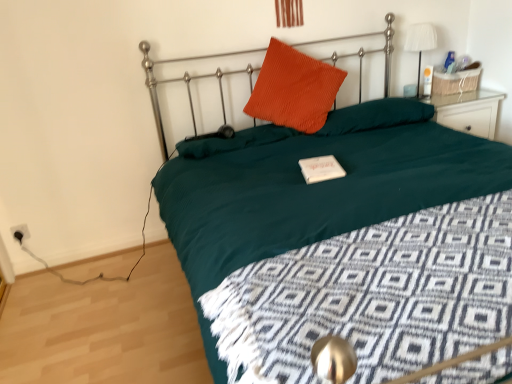
This screenshot has height=384, width=512. Describe the element at coordinates (234, 141) in the screenshot. I see `orange corduroy pillow at center, the first pillow when ordered from left to right` at that location.

Locate an element on the screen. Image resolution: width=512 pixels, height=384 pixels. orange corduroy pillow at center, the first pillow when ordered from left to right is located at coordinates (234, 141).

Find the location of a particular element. The height and width of the screenshot is (384, 512). corduroy orange pillow at center, the second pillow from the right is located at coordinates (294, 89).

What do you see at coordinates (20, 232) in the screenshot?
I see `black plastic socket at lower left` at bounding box center [20, 232].

This screenshot has height=384, width=512. What are the coordinates of `white fabric lampshade at upper right` in the screenshot? It's located at (420, 42).

Does teal fabric bed at center have a larger size compared to orange corduroy pillow at upper center, the 3th pillow in the left-to-right sequence?

Yes.

From a real-world perspective, between teal fabric bed at center and orange corduroy pillow at upper center, the 3th pillow in the left-to-right sequence, who is vertically higher?

From a 3D spatial view, orange corduroy pillow at upper center, the 3th pillow in the left-to-right sequence, is above.

Which object is more forward, teal fabric bed at center or orange corduroy pillow at upper center, the 1th pillow positioned from the right?

teal fabric bed at center is in front.

Is black plastic socket at lower left situated inside orange corduroy pillow at upper center, the 1th pillow positioned from the right, or outside?

black plastic socket at lower left is spatially situated outside orange corduroy pillow at upper center, the 1th pillow positioned from the right.

Is black plastic socket at lower left to the left or to the right of orange corduroy pillow at upper center, the 3th pillow in the left-to-right sequence, in the image?

Based on their positions, black plastic socket at lower left is located to the left of orange corduroy pillow at upper center, the 3th pillow in the left-to-right sequence.

Where is `electric outlet on the left of orange corduroy pillow at upper center, the 1th pillow positioned from the right`? The width and height of the screenshot is (512, 384). electric outlet on the left of orange corduroy pillow at upper center, the 1th pillow positioned from the right is located at coordinates (20, 232).

Can you confirm if orange corduroy pillow at center, the first pillow when ordered from left to right, is bigger than white fabric lampshade at upper right?

Correct, orange corduroy pillow at center, the first pillow when ordered from left to right, is larger in size than white fabric lampshade at upper right.

How much distance is there between orange corduroy pillow at center, the 3th pillow viewed from the right, and white fabric lampshade at upper right?

The distance of orange corduroy pillow at center, the 3th pillow viewed from the right, from white fabric lampshade at upper right is 4.28 feet.

What's the angular difference between orange corduroy pillow at center, the 3th pillow viewed from the right, and white fabric lampshade at upper right's facing directions?

0.624 degrees.

Is orange corduroy pillow at center, the 3th pillow viewed from the right, to the left of white fabric lampshade at upper right from the viewer's perspective?

Yes.

Which is correct: black plastic socket at lower left is inside white fabric lampshade at upper right, or outside of it?

black plastic socket at lower left lies outside white fabric lampshade at upper right.

Does black plastic socket at lower left lie behind white fabric lampshade at upper right?

No, the depth of black plastic socket at lower left is less than that of white fabric lampshade at upper right.

Locate an element on the screen. This screenshot has height=384, width=512. electric outlet in front of the white fabric lampshade at upper right is located at coordinates (20, 232).

Is teal fabric bed at center facing towards black plastic socket at lower left?

No, teal fabric bed at center does not turn towards black plastic socket at lower left.

Is teal fabric bed at center completely or partially outside of black plastic socket at lower left?

Yes, teal fabric bed at center is not within black plastic socket at lower left.

From a real-world perspective, is teal fabric bed at center physically below black plastic socket at lower left?

No, from a real-world perspective, teal fabric bed at center is not beneath black plastic socket at lower left.

From the image's perspective, between teal fabric bed at center and black plastic socket at lower left, who is located below?

black plastic socket at lower left appears lower in the image.

From a real-world perspective, which is physically above, black plastic socket at lower left or corduroy orange pillow at center, positioned as the 2th pillow in left-to-right order?

corduroy orange pillow at center, positioned as the 2th pillow in left-to-right order, is physically above.

Considering their positions, is black plastic socket at lower left located in front of or behind corduroy orange pillow at center, positioned as the 2th pillow in left-to-right order?

In the image, black plastic socket at lower left appears behind corduroy orange pillow at center, positioned as the 2th pillow in left-to-right order.

In the scene shown: Considering the sizes of black plastic socket at lower left and corduroy orange pillow at center, the second pillow from the right, in the image, is black plastic socket at lower left taller or shorter than corduroy orange pillow at center, the second pillow from the right,?

In the image, black plastic socket at lower left appears to be shorter than corduroy orange pillow at center, the second pillow from the right.

How many degrees apart are the facing directions of black plastic socket at lower left and corduroy orange pillow at center, the second pillow from the right?

14.1 degrees.

Which is behind, point (202, 250) or point (426, 44)?

Positioned behind is point (426, 44).

Is teal fabric bed at center turned away from white fabric lampshade at upper right?

No, white fabric lampshade at upper right is not at the back of teal fabric bed at center.

Between teal fabric bed at center and white fabric lampshade at upper right, which one has larger size?

teal fabric bed at center is bigger.

Does teal fabric bed at center touch white fabric lampshade at upper right?

No, teal fabric bed at center is not touching white fabric lampshade at upper right.

Where is `bed in front of the orange corduroy pillow at upper center, the 1th pillow positioned from the right`? The width and height of the screenshot is (512, 384). bed in front of the orange corduroy pillow at upper center, the 1th pillow positioned from the right is located at coordinates (312, 196).

I want to click on electric outlet below the orange corduroy pillow at upper center, the 1th pillow positioned from the right (from a real-world perspective), so 20,232.

Based on their spatial positions, is corduroy orange pillow at center, positioned as the 2th pillow in left-to-right order, or black plastic socket at lower left closer to orange corduroy pillow at center, the first pillow when ordered from left to right?

The object closer to orange corduroy pillow at center, the first pillow when ordered from left to right, is corduroy orange pillow at center, positioned as the 2th pillow in left-to-right order.

From the image, which object appears to be farther from white fabric lampshade at upper right, teal fabric bed at center or orange corduroy pillow at center, the 3th pillow viewed from the right?

teal fabric bed at center.

When comparing their distances from teal fabric bed at center, does white fabric lampshade at upper right or orange corduroy pillow at upper center, the 3th pillow in the left-to-right sequence, seem further?

The object further to teal fabric bed at center is white fabric lampshade at upper right.

Looking at the image, which one is located further to white fabric lampshade at upper right, black plastic socket at lower left or orange corduroy pillow at upper center, the 1th pillow positioned from the right?

black plastic socket at lower left lies further to white fabric lampshade at upper right than the other object.

Estimate the real-world distances between objects in this image. Which object is closer to orange corduroy pillow at center, the first pillow when ordered from left to right, teal fabric bed at center or black plastic socket at lower left?

teal fabric bed at center is positioned closer to the anchor orange corduroy pillow at center, the first pillow when ordered from left to right.

Considering their positions, is orange corduroy pillow at upper center, the 3th pillow in the left-to-right sequence, positioned further to orange corduroy pillow at center, the first pillow when ordered from left to right, than white fabric lampshade at upper right?

white fabric lampshade at upper right lies further to orange corduroy pillow at center, the first pillow when ordered from left to right, than the other object.

Estimate the real-world distances between objects in this image. Which object is closer to orange corduroy pillow at upper center, the 1th pillow positioned from the right, black plastic socket at lower left or orange corduroy pillow at center, the 3th pillow viewed from the right?

Based on the image, orange corduroy pillow at center, the 3th pillow viewed from the right, appears to be nearer to orange corduroy pillow at upper center, the 1th pillow positioned from the right.

Based on their spatial positions, is orange corduroy pillow at upper center, the 1th pillow positioned from the right, or black plastic socket at lower left closer to corduroy orange pillow at center, positioned as the 2th pillow in left-to-right order?

Based on the image, orange corduroy pillow at upper center, the 1th pillow positioned from the right, appears to be nearer to corduroy orange pillow at center, positioned as the 2th pillow in left-to-right order.

In order to click on pillow between teal fabric bed at center and corduroy orange pillow at center, the second pillow from the right, from front to back in this screenshot , I will do `click(234, 141)`.

Where is `bed situated between black plastic socket at lower left and white fabric lampshade at upper right from left to right`? This screenshot has width=512, height=384. bed situated between black plastic socket at lower left and white fabric lampshade at upper right from left to right is located at coordinates (312, 196).

The image size is (512, 384). In order to click on pillow between corduroy orange pillow at center, the second pillow from the right, and white fabric lampshade at upper right, in the horizontal direction in this screenshot , I will do `click(376, 116)`.

Find the location of a particular element. The width and height of the screenshot is (512, 384). pillow between orange corduroy pillow at center, the first pillow when ordered from left to right, and orange corduroy pillow at upper center, the 1th pillow positioned from the right, in the horizontal direction is located at coordinates (294, 89).